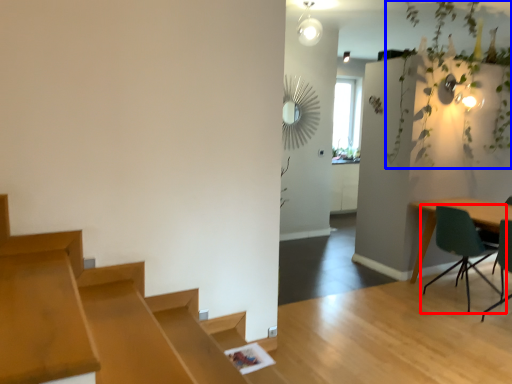
Question: Which object is further to the camera taking this photo, chair (highlighted by a red box) or vegetation (highlighted by a blue box)?

Choices:
 (A) chair
 (B) vegetation

Answer: (B)